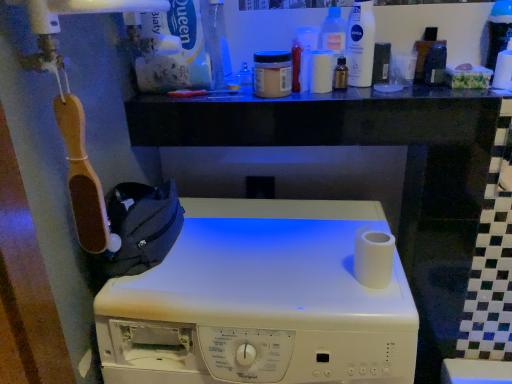
Where is `vacant space to the left of white matte toilet paper at upper right, which ranks as the first toilet paper in top-to-bottom order`? Image resolution: width=512 pixels, height=384 pixels. vacant space to the left of white matte toilet paper at upper right, which ranks as the first toilet paper in top-to-bottom order is located at coordinates (443, 91).